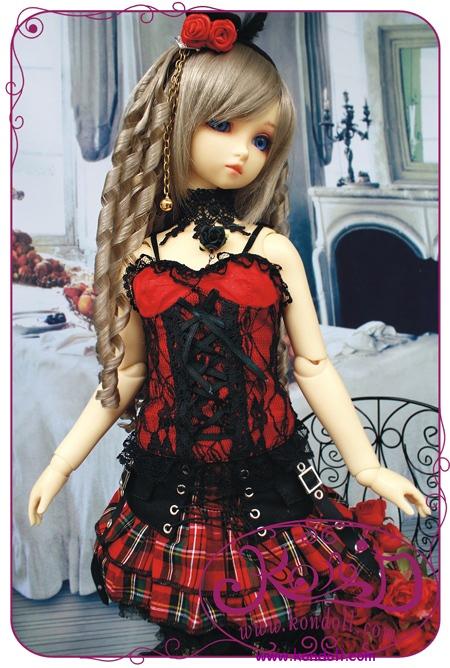
The width and height of the screenshot is (450, 668). Identify the location of doll. (193, 240).